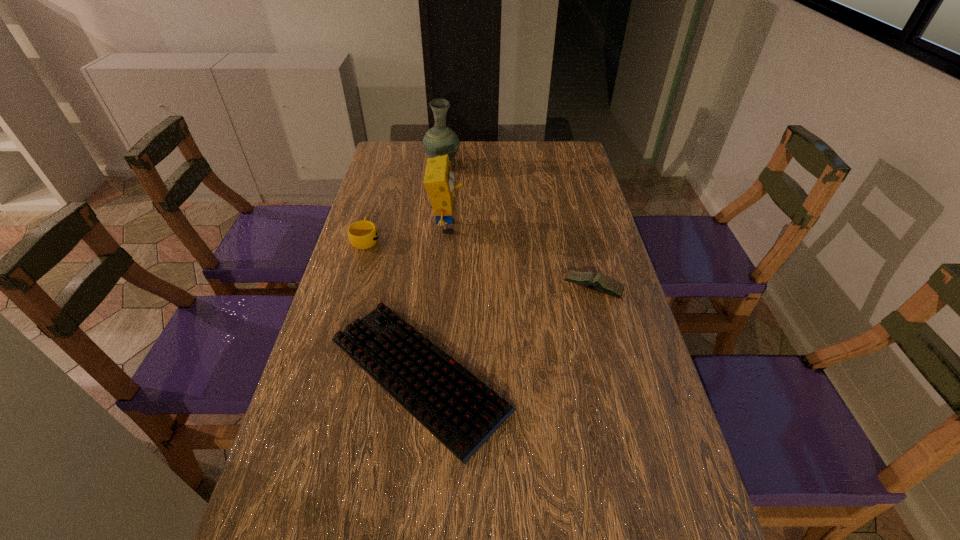
Identify the location of the farthest object. (440, 140).

Where is `sponge`? sponge is located at coordinates (439, 179).

Locate an element on the screen. Image resolution: width=960 pixels, height=540 pixels. cup is located at coordinates (363, 234).

This screenshot has width=960, height=540. I want to click on the fourth farthest object, so click(598, 282).

At what (x,y) coordinates should I click in order to perform the action: click on diary. Please return your answer as a coordinate pair (x, y). Looking at the image, I should click on (598, 282).

The height and width of the screenshot is (540, 960). I want to click on the shortest object, so click(460, 410).

Find the location of a particular element. The height and width of the screenshot is (540, 960). computer keyboard is located at coordinates (460, 410).

You are a GUI agent. You are given a task and a screenshot of the screen. Output one action in this format:
    pyautogui.click(x=<x>, y=<y>)
    Task: Click on the free space located 0.070m on the handle side of the pitcher
    This screenshot has height=540, width=960.
    Given the screenshot: What is the action you would take?
    pyautogui.click(x=444, y=148)

This screenshot has width=960, height=540. In order to click on vacant region located on the face of the sponge in this screenshot , I will do `click(502, 227)`.

At what (x,y) coordinates should I click in order to perform the action: click on free space located 0.070m on the back of the cup. Please return your answer as a coordinate pair (x, y). This screenshot has height=540, width=960. Looking at the image, I should click on (372, 215).